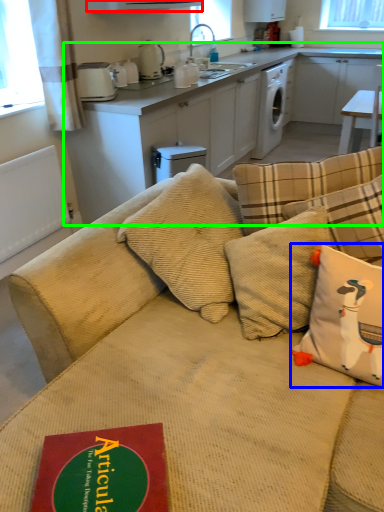
Question: Which is farther away from exhaust hood (highlighted by a red box)? pillow (highlighted by a blue box) or cabinetry (highlighted by a green box)?

Choices:
 (A) pillow
 (B) cabinetry

Answer: (A)